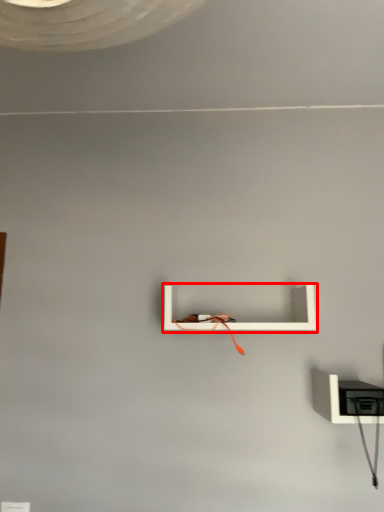
Question: Observing the image, what is the correct spatial positioning of shelf (annotated by the red box) in reference to shelf?

Choices:
 (A) left
 (B) right

Answer: (A)